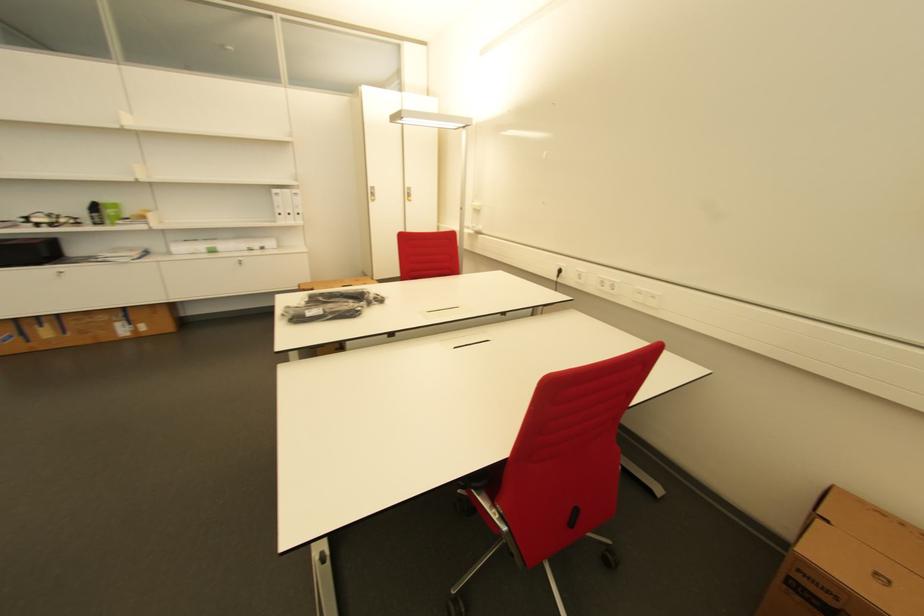
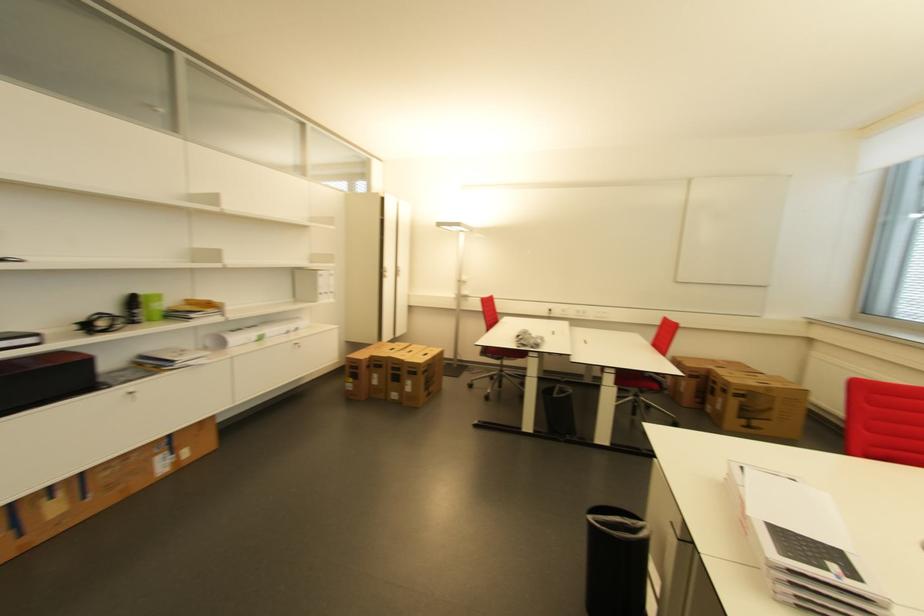
Find the pixel in the second image that matches the point at 67,274 in the first image.

(137, 394)